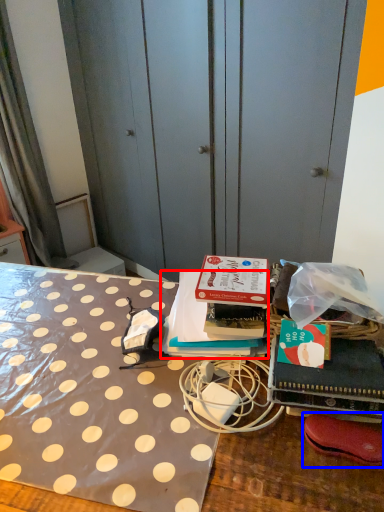
Question: Which point is further to the camera, book (highlighted by a red box) or footwear (highlighted by a blue box)?

Choices:
 (A) book
 (B) footwear

Answer: (A)